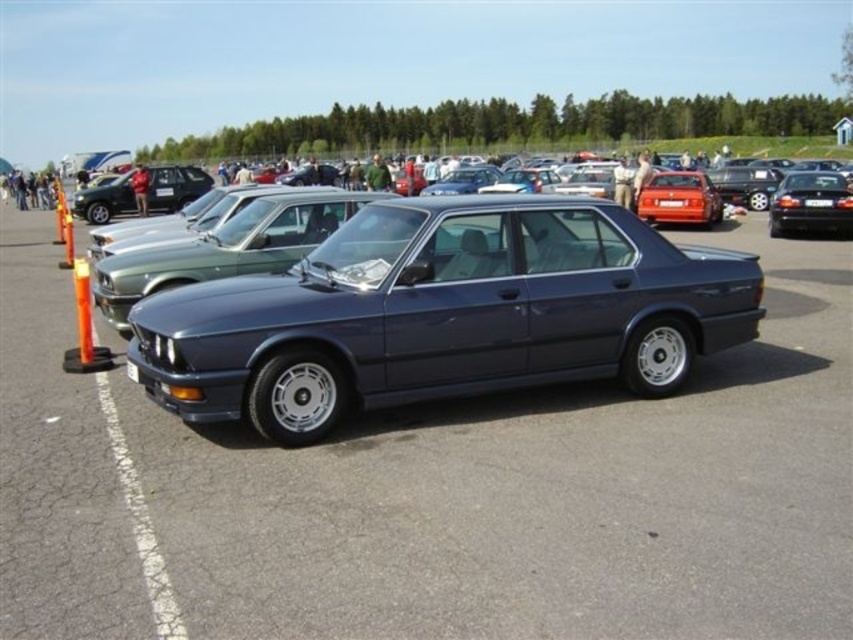
Question: Does metallic blue car at center appear on the right side of orange plastic cone at left?

Choices:
 (A) no
 (B) yes

Answer: (B)

Question: Can you confirm if metallic blue car at center is thinner than metallic silver sedan at center?

Choices:
 (A) no
 (B) yes

Answer: (A)

Question: Observing the image, what is the correct spatial positioning of shiny red sedan at center in reference to orange plastic cone at left?

Choices:
 (A) above
 (B) below

Answer: (A)

Question: Which point is farther from the camera taking this photo?

Choices:
 (A) (795, 416)
 (B) (704, 202)
 (C) (844, 208)
 (D) (96, 208)

Answer: (D)

Question: Which point appears closest to the camera in this image?

Choices:
 (A) (67, 360)
 (B) (663, 186)
 (C) (282, 353)
 (D) (672, 202)

Answer: (C)

Question: Among these points, which one is nearest to the camera?

Choices:
 (A) (84, 312)
 (B) (775, 230)

Answer: (A)